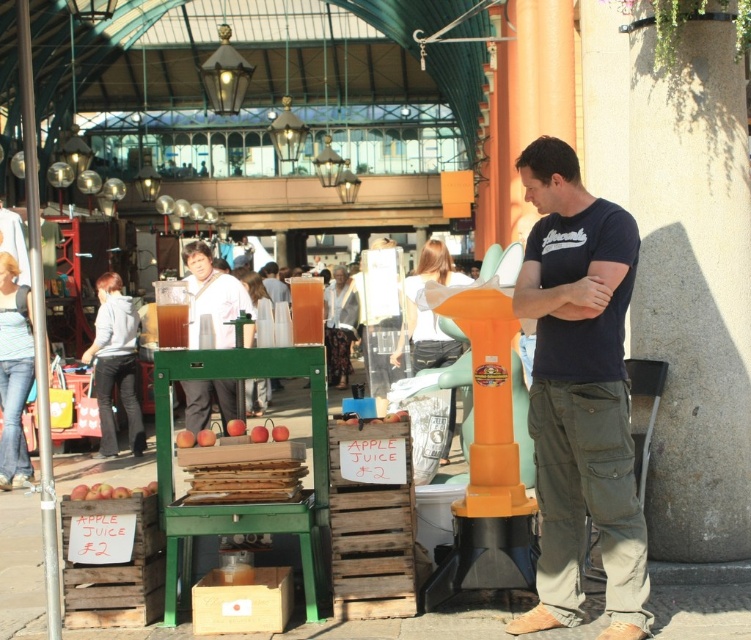
Is dark blue t-shirt at center bigger than white matte jacket at center?

Yes.

Image resolution: width=751 pixels, height=640 pixels. What do you see at coordinates (581, 394) in the screenshot?
I see `dark blue t-shirt at center` at bounding box center [581, 394].

I want to click on dark blue t-shirt at center, so click(581, 394).